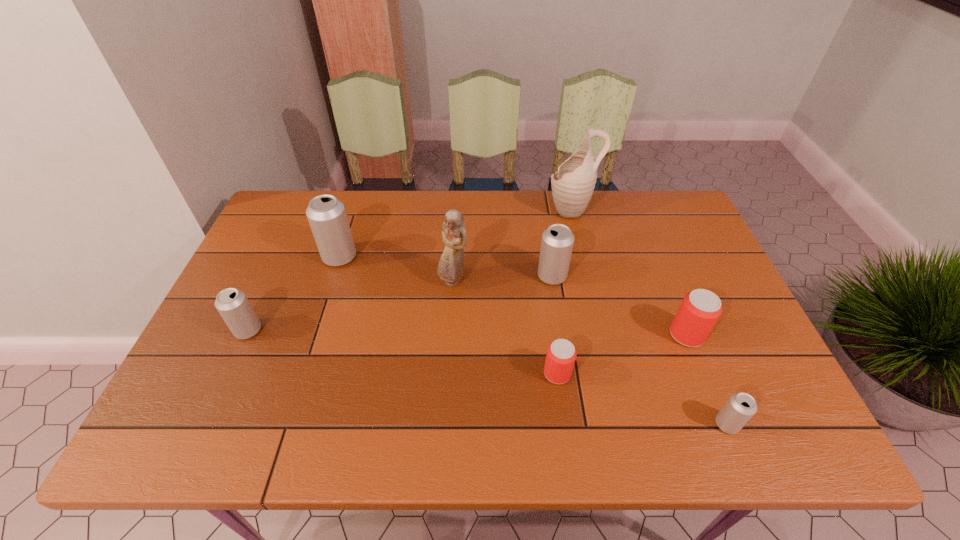
In the image, there is a desktop. What are the coordinates of `vacant space at the far edge` in the screenshot? It's located at (352, 210).

Locate an element on the screen. The height and width of the screenshot is (540, 960). vacant space at the near edge is located at coordinates (369, 446).

You are a GUI agent. You are given a task and a screenshot of the screen. Output one action in this format:
    pyautogui.click(x=<x>, y=<y>)
    Task: Click on the vacant area that lies between the second nearest object and the figurine
    
    Given the screenshot: What is the action you would take?
    pyautogui.click(x=505, y=327)

This screenshot has height=540, width=960. Identify the location of free space between the second nearest object and the third biggest white beer can. (402, 352).

Image resolution: width=960 pixels, height=540 pixels. What are the coordinates of `vacant area that lies between the leftmost beer can and the nearer red beer can` in the screenshot? It's located at (402, 352).

Where is `empty space that is in between the third farthest white beer can and the bigger red beer can`? This screenshot has height=540, width=960. empty space that is in between the third farthest white beer can and the bigger red beer can is located at coordinates (468, 333).

This screenshot has width=960, height=540. In order to click on free space between the leftmost white beer can and the sixth object from right to left in this screenshot , I will do `click(350, 306)`.

Image resolution: width=960 pixels, height=540 pixels. I want to click on vacant area that lies between the nearest beer can and the pitcher, so click(649, 317).

Find the location of `free point between the nearer red beer can and the biggest white beer can`. free point between the nearer red beer can and the biggest white beer can is located at coordinates (448, 315).

Locate an element on the screen. vacant area between the nearer red beer can and the nearest white beer can is located at coordinates (642, 399).